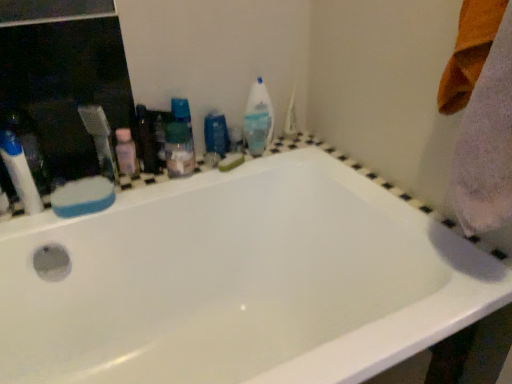
Question: From a real-world perspective, is white glossy bathtub at center above or below translucent plastic spray bottle at upper center?

Choices:
 (A) below
 (B) above

Answer: (A)

Question: Is point (465, 253) closer or farther from the camera than point (267, 114)?

Choices:
 (A) farther
 (B) closer

Answer: (B)

Question: Based on their relative distances, which object is farther from the translucent plastic mouthwash at center, placed as the 2th mouthwash when sorted from right to left?

Choices:
 (A) translucent plastic spray bottle at upper center
 (B) white plastic toothbrush at left
 (C) pink plastic bottle at upper left, the second toiletry viewed from the left
 (D) blue glossy mouthwash at center, marked as the second mouthwash in a front-to-back arrangement
 (E) green sponge at upper center, which ranks as the second soap in front-to-back order

Answer: (A)

Question: Estimate the real-world distances between objects in this image. Which object is closer to the white glossy bathtub at center?

Choices:
 (A) blue glossy mouthwash at center, placed as the first mouthwash when sorted from right to left
 (B) translucent plastic toothbrush at left, marked as the 2th toiletry in a back-to-front arrangement
 (C) blue sponge at upper left, marked as the 1th soap in a left-to-right arrangement
 (D) translucent plastic mouthwash at center, which is counted as the 1th mouthwash, starting from the front
 (E) white plastic toothbrush at left

Answer: (D)